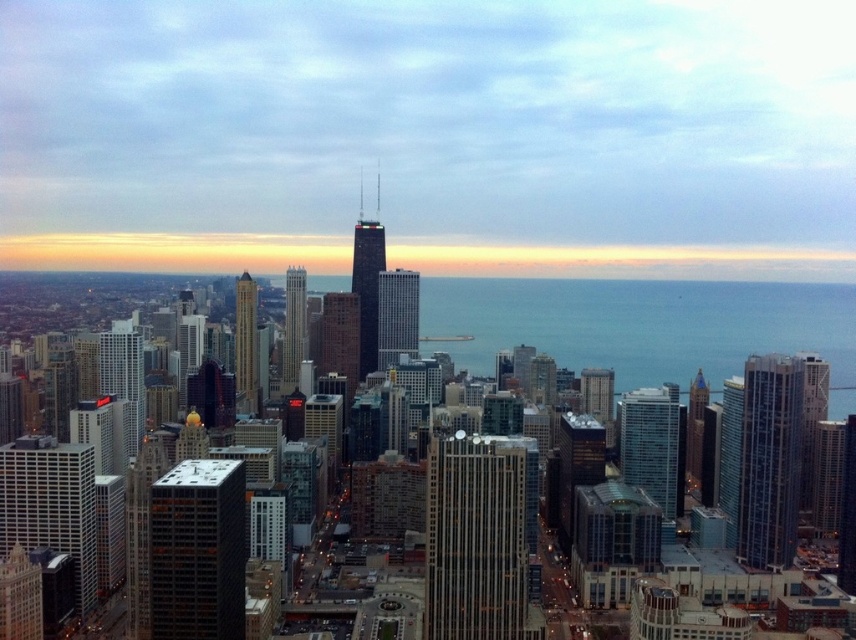
Question: Considering the real-world distances, which object is closest to the glassy steel skyscraper at center?

Choices:
 (A) shiny gold skyscraper at center-right
 (B) white glass skyscraper at left

Answer: (A)

Question: Can you confirm if glassy teal skyscraper at center is smaller than shiny gold skyscraper at center-right?

Choices:
 (A) no
 (B) yes

Answer: (A)

Question: Which of the following is the closest to the observer?

Choices:
 (A) [x=379, y=230]
 (B) [x=293, y=358]
 (C) [x=623, y=442]

Answer: (A)

Question: Is white glass skyscraper at left wider than glassy teal skyscraper at center?

Choices:
 (A) yes
 (B) no

Answer: (A)

Question: Can you confirm if glassy teal skyscraper at center is bigger than matte glass skyscraper at center?

Choices:
 (A) no
 (B) yes

Answer: (B)

Question: Which point is closer to the camera?

Choices:
 (A) shiny glass skyscraper at left
 (B) glassy teal skyscraper at center
 (C) shiny gold skyscraper at center-right

Answer: (A)